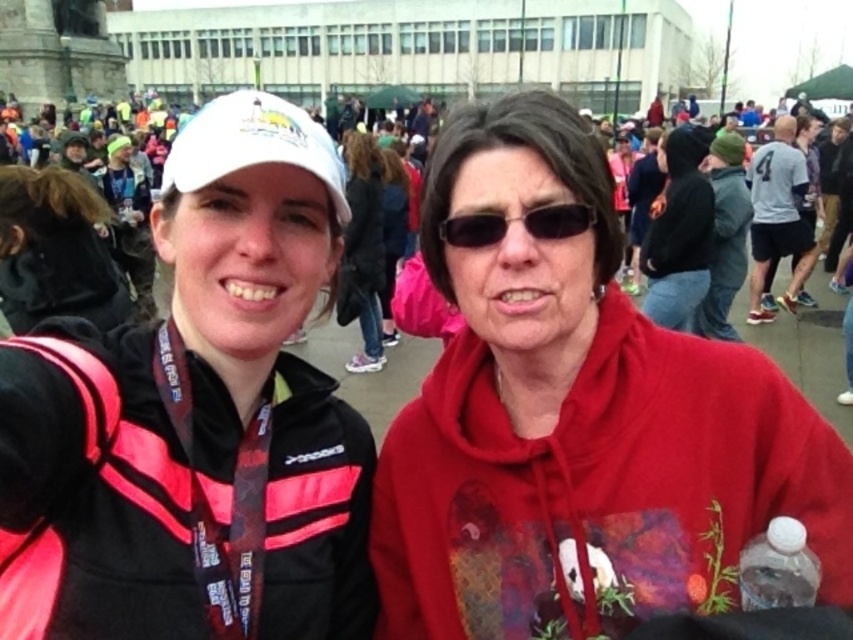
You are a photographer at the event and want to capture a photo that includes both the black matte jacket at left and the dark brown hair at center. Which object should you focus on first to ensure both are in sharp focus?

The black matte jacket at left is closer to the viewer than dark brown hair at center. To ensure both are in sharp focus, you should focus on the black matte jacket at left first, as it is the closer object.

You are a photographer at the event and want to capture a photo that includes both the black matte jacket at left and the dark brown hair at center. Based on their positions, which object should you focus on first to ensure both are in frame?

The black matte jacket at left is to the left of dark brown hair at center. To include both in the frame, focus on the black matte jacket at left first since it is positioned to the left of the dark brown hair at center, ensuring the entire span from left to right is captured.